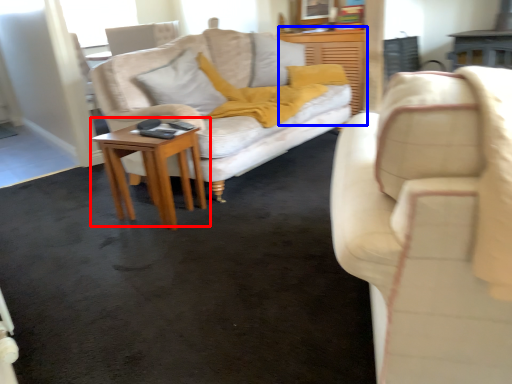
Question: Which of the following is the farthest to the observer, table (highlighted by a red box) or dresser (highlighted by a blue box)?

Choices:
 (A) table
 (B) dresser

Answer: (B)